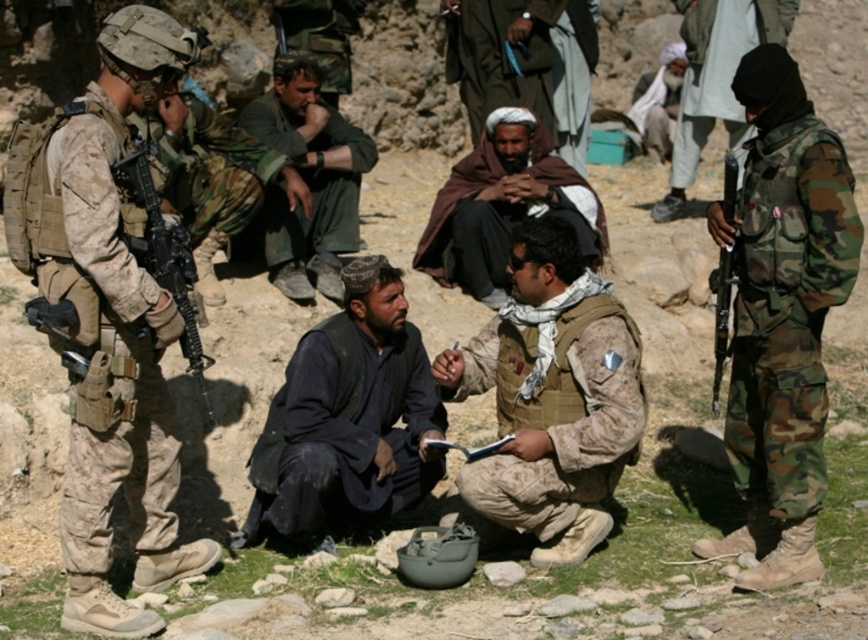
Question: Does brown woolen shawl at center appear on the left side of matte black rifle at left?

Choices:
 (A) no
 (B) yes

Answer: (A)

Question: Which of these objects is positioned closest to the dark green uniform at center?

Choices:
 (A) brown woolen shawl at center
 (B) camouflage uniform at right
 (C) matte black rifle at right
 (D) camouflage fabric vest at center

Answer: (A)

Question: Which point is closer to the camera?

Choices:
 (A) (813, 416)
 (B) (275, 218)
 (C) (411, 385)
 (D) (194, 269)

Answer: (D)

Question: Is camouflage fabric vest at center thinner than matte black rifle at right?

Choices:
 (A) yes
 (B) no

Answer: (A)

Question: Which of the following is the closest to the observer?

Choices:
 (A) camouflage uniform at right
 (B) matte black rifle at right

Answer: (B)

Question: Does camouflage fabric uniform at right lie behind matte black rifle at left?

Choices:
 (A) no
 (B) yes

Answer: (B)